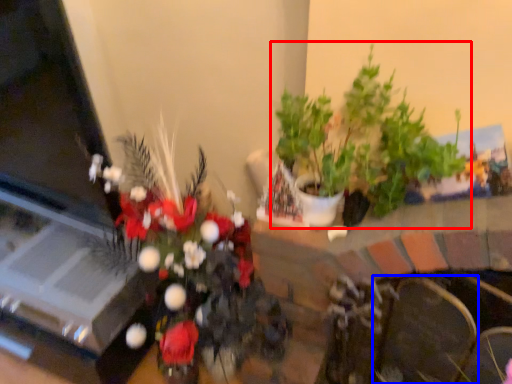
Question: Which of the following is the farthest to the observer, houseplant (highlighted by a red box) or armchair (highlighted by a blue box)?

Choices:
 (A) houseplant
 (B) armchair

Answer: (B)